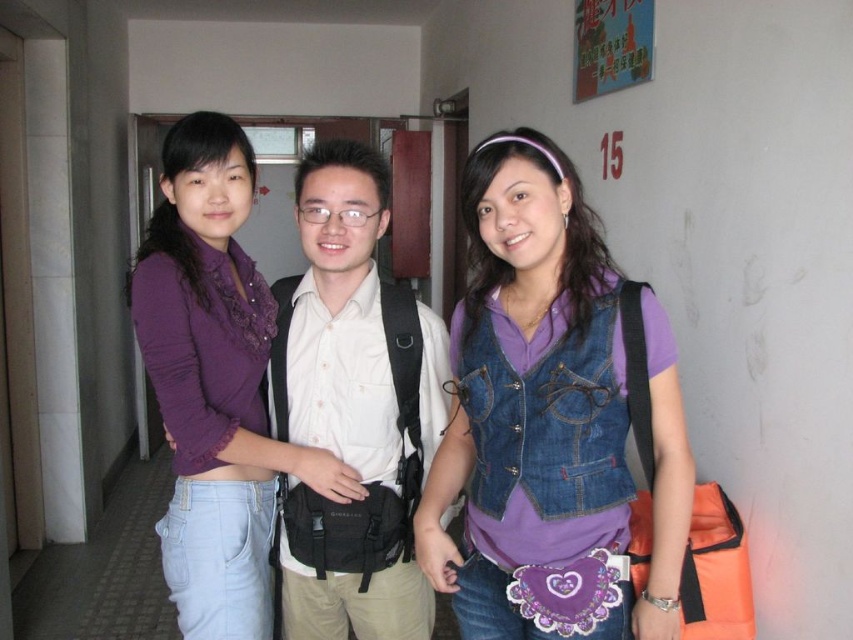
Consider the image. Between denim vest at center and purple lace shirt at center, which one is positioned lower?

denim vest at center is lower down.

Can you confirm if denim vest at center is shorter than purple lace shirt at center?

Yes.

Who is more distant from viewer, (538,637) or (204,561)?

Point (204,561)

At what (x,y) coordinates should I click in order to perform the action: click on denim vest at center. Please return your answer as a coordinate pair (x, y). This screenshot has height=640, width=853. Looking at the image, I should click on (527, 388).

What do you see at coordinates (352, 410) in the screenshot? I see `white matte shirt at center` at bounding box center [352, 410].

Does white matte shirt at center have a larger size compared to purple lace shirt at center?

Actually, white matte shirt at center might be smaller than purple lace shirt at center.

Is point (322, 557) farther from viewer compared to point (144, 314)?

Yes, it is.

Image resolution: width=853 pixels, height=640 pixels. What are the coordinates of `white matte shirt at center` in the screenshot? It's located at (352, 410).

Who is lower down, denim vest at center or white matte shirt at center?

Positioned lower is white matte shirt at center.

Between point (479, 611) and point (351, 384), which one is positioned behind?

Point (351, 384)

What are the coordinates of `denim vest at center` in the screenshot? It's located at (527, 388).